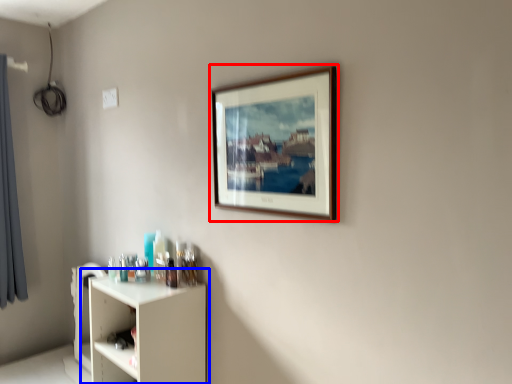
Question: Which object appears farthest to the camera in this image, picture frame (highlighted by a red box) or shelf (highlighted by a blue box)?

Choices:
 (A) picture frame
 (B) shelf

Answer: (B)